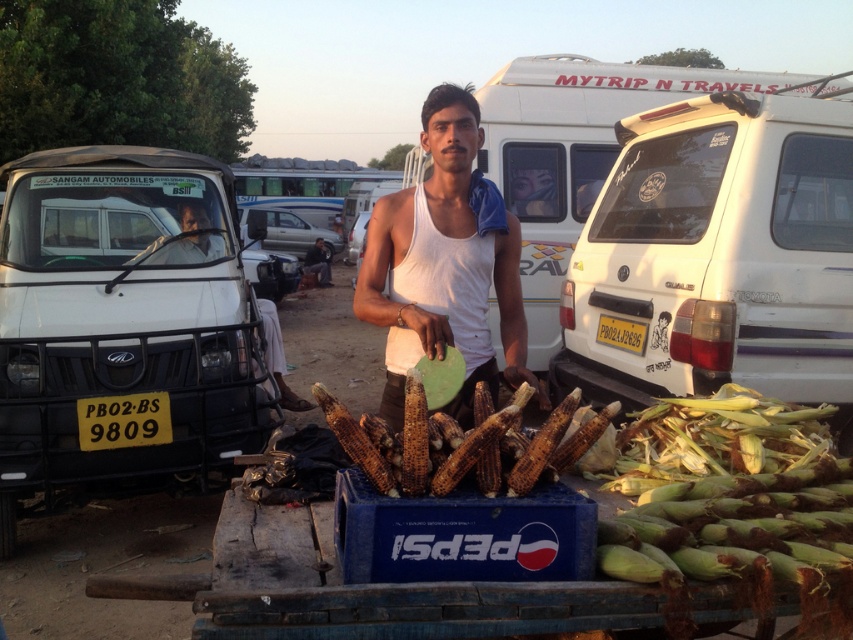
Question: Which object is farther from the camera taking this photo?

Choices:
 (A) dark blue jeans at center
 (B) yellowmaterial/texturelicense plate at center
 (C) yellowmaterial/texturelicense plate at lower left
 (D) white matte van at right

Answer: (A)

Question: Is brown matte corn at center above yellowmaterial/texturelicense plate at lower left?

Choices:
 (A) no
 (B) yes

Answer: (B)

Question: Among these points, which one is farthest from the camera?

Choices:
 (A) (421, 408)
 (B) (376, 236)
 (C) (132, 432)

Answer: (C)

Question: Which object is the closest to the yellowmaterial/texturelicense plate at lower left?

Choices:
 (A) yellowmaterial/texturelicense plate at center
 (B) brown matte corn at center
 (C) dark blue jeans at center
 (D) white matte van at right

Answer: (B)

Question: Where is white matte van at right located in relation to dark blue jeans at center in the image?

Choices:
 (A) right
 (B) left

Answer: (A)

Question: Can you confirm if yellowmaterial/texturelicense plate at lower left is smaller than yellowmaterial/texturelicense plate at center?

Choices:
 (A) yes
 (B) no

Answer: (B)